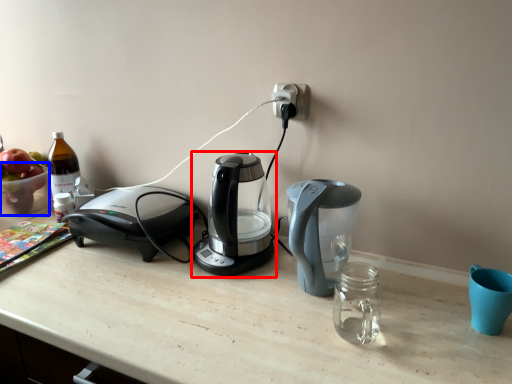
Question: Which object is further to the camera taking this photo, coffee maker (highlighted by a red box) or bowl (highlighted by a blue box)?

Choices:
 (A) coffee maker
 (B) bowl

Answer: (B)